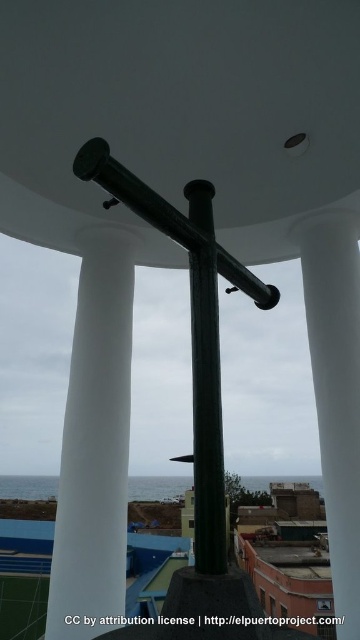
You are standing in front of the green cross structure and notice two white supports. Which one is positioned more to the left side, the white smooth column at left or the white smooth pillar at center?

The white smooth column at left is positioned more to the left side than the white smooth pillar at center.

You are standing at the center of the green cross structure in the circular space. You want to move towards the white smooth column at left. Which direction should you face to walk straight towards it?

To reach the white smooth column at left from the center of the green cross structure, you should face the direction where the column is located, which is at coordinates point (95, 442). Since the column is positioned at the left side of the structure, you should face towards the left direction to walk straight towards it.

You are standing in front of the green cross structure in the circular gazebo. You notice two points marked at coordinates point (74, 481) and point (218, 451). Which point is closer to your current position?

Point (74, 481) is further to the camera than point (218, 451), so the point closer to your current position is point (218, 451).